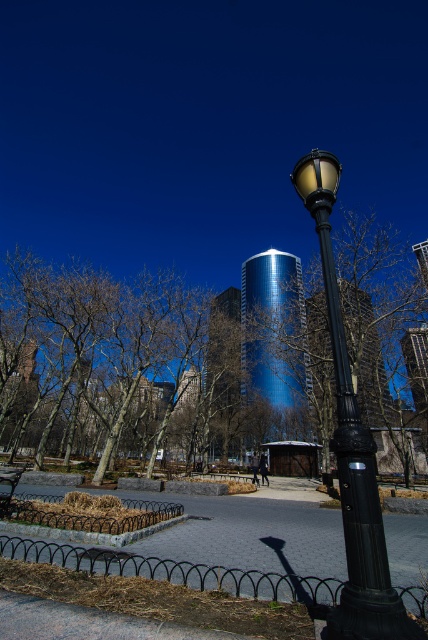
Question: Which of the following is the closest to the observer?

Choices:
 (A) (385, 317)
 (B) (14, 474)

Answer: (B)

Question: Is black polished metal street light at right to the left of bare branches at center from the viewer's perspective?

Choices:
 (A) yes
 (B) no

Answer: (A)

Question: Which point appears closest to the camera in this image?

Choices:
 (A) (345, 298)
 (B) (0, 508)

Answer: (B)

Question: Considering the relative positions of bare branches at center and wooden park bench at lower left in the image provided, where is bare branches at center located with respect to wooden park bench at lower left?

Choices:
 (A) below
 (B) above

Answer: (B)

Question: Estimate the real-world distances between objects in this image. Which object is farther from the wooden park bench at lower left?

Choices:
 (A) bare branches at center
 (B) black polished metal street light at right

Answer: (A)

Question: Is black polished metal street light at right bigger than wooden park bench at lower left?

Choices:
 (A) yes
 (B) no

Answer: (B)